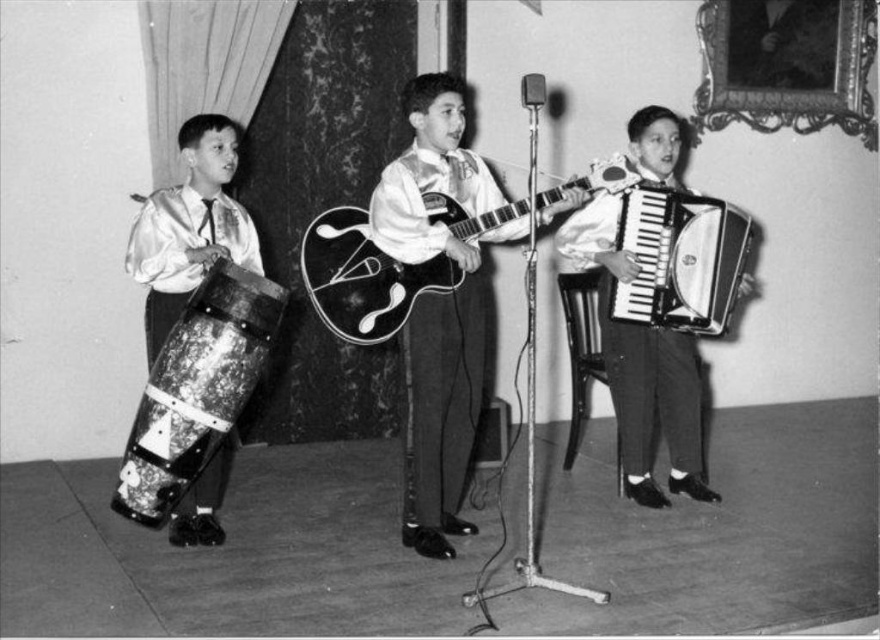
Can you confirm if shiny black guitar at center is thinner than distressed wood drum at left?

No, shiny black guitar at center is not thinner than distressed wood drum at left.

Does shiny black guitar at center come behind distressed wood drum at left?

That is True.

Is point (440, 474) positioned before point (224, 353)?

No, (440, 474) is behind (224, 353).

Locate an element on the screen. Image resolution: width=880 pixels, height=640 pixels. shiny black guitar at center is located at coordinates (440, 307).

From the picture: Is the position of shiny black guitar at center less distant than that of metallic silver accordion at center?

Yes, it is.

Can you confirm if shiny black guitar at center is positioned below metallic silver accordion at center?

Indeed, shiny black guitar at center is positioned under metallic silver accordion at center.

Is point (453, 152) positioned after point (717, 317)?

No, (453, 152) is closer to viewer.

At what (x,y) coordinates should I click in order to perform the action: click on shiny black guitar at center. Please return your answer as a coordinate pair (x, y). Looking at the image, I should click on (440, 307).

Based on the photo, which is more to the left, shiny black guitar at center or shiny silver accordion at center?

shiny black guitar at center

Does shiny black guitar at center lie in front of shiny silver accordion at center?

Yes.

Between point (466, 388) and point (684, 401), which one is positioned in front?

Point (466, 388) is more forward.

Find the location of a particular element. Image resolution: width=880 pixels, height=640 pixels. shiny black guitar at center is located at coordinates (440, 307).